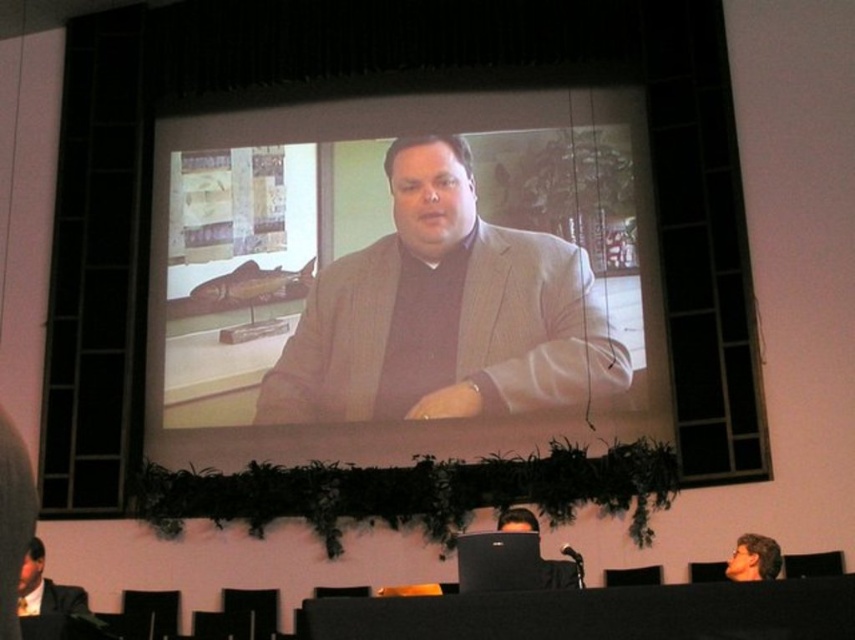
You are an event organizer setting up a conference room. You need to place a new decorative item on the black fabric table at lower center so that it is visible to the person with smooth brown hair at lower right. Based on the current setup, will the item be visible to them?

The black fabric table at lower center is in front of smooth brown hair at lower right, so the decorative item placed on the black fabric table at lower center will be visible to the person with smooth brown hair at lower right because the table is positioned in front of them, allowing line of sight.

In the scene where a presentation is happening, there is a matte gray suit at center and a black fabric table at lower center. Which object is wider?

The matte gray suit at center is wider than the black fabric table at lower center.